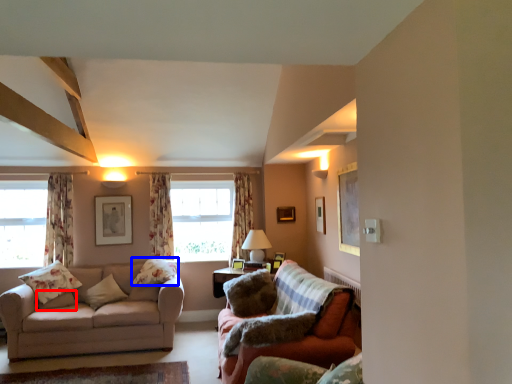
Question: Which of the following is the closest to the observer, pillow (highlighted by a red box) or pillow (highlighted by a blue box)?

Choices:
 (A) pillow
 (B) pillow

Answer: (A)